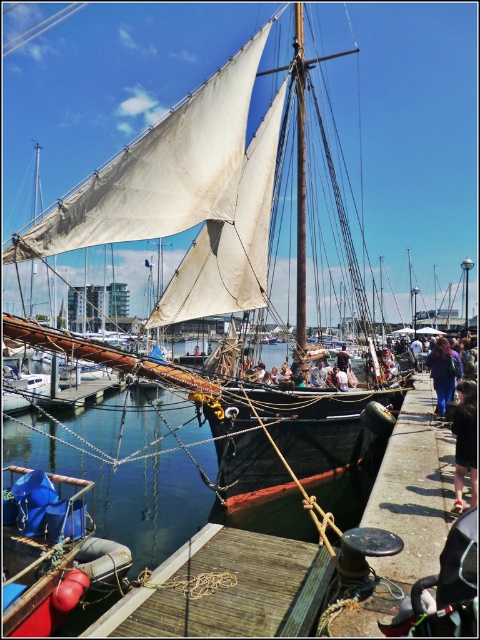
You are standing on the deck of the ship and want to walk to the wooden area at lower center. Which direction should you move relative to your current position at point (227, 589)?

The point (227, 589) corresponds to the wooden area at lower center, so you are already there.

You are standing on the deck of the ship and need to place a small potted plant. The wooden at lower center is not as tall as the light brown leather jacket at center. Which object should you place the plant on to ensure it is visible from above?

The light brown leather jacket at center is taller than the wooden at lower center, so placing the plant on the light brown leather jacket at center would make it more visible from above.